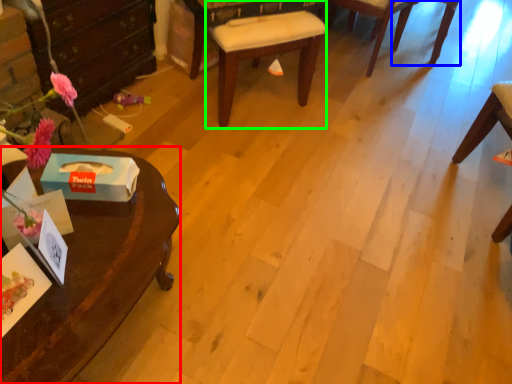
Question: Estimate the real-world distances between objects in this image. Which object is closer to desk (highlighted by a red box), chair (highlighted by a blue box) or chair (highlighted by a green box)?

Choices:
 (A) chair
 (B) chair

Answer: (B)